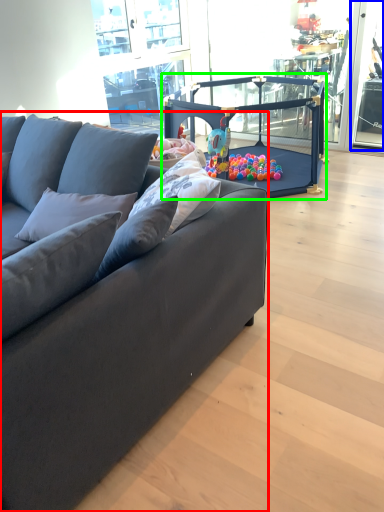
Question: Which object is the closest to the studio couch (highlighted by a red box)? Choose among these: window screen (highlighted by a blue box) or baby carriage (highlighted by a green box).

Choices:
 (A) window screen
 (B) baby carriage

Answer: (B)